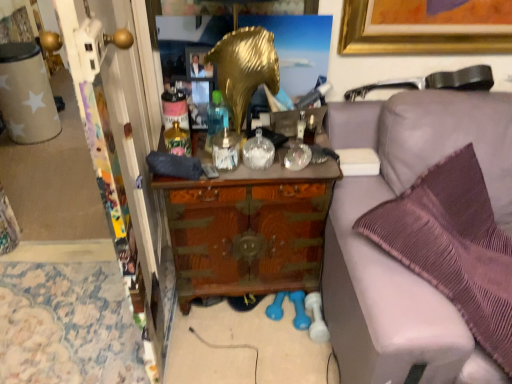
Question: Is wooden chest at center positioned behind gold metallic picture frame at upper center?

Choices:
 (A) yes
 (B) no

Answer: (B)

Question: Does wooden chest at center touch gold metallic picture frame at upper center?

Choices:
 (A) yes
 (B) no

Answer: (B)

Question: Considering the relative sizes of wooden chest at center and gold metallic picture frame at upper center in the image provided, is wooden chest at center shorter than gold metallic picture frame at upper center?

Choices:
 (A) yes
 (B) no

Answer: (B)

Question: Can you confirm if wooden chest at center is wider than gold metallic picture frame at upper center?

Choices:
 (A) yes
 (B) no

Answer: (A)

Question: Is wooden chest at center to the left of gold metallic picture frame at upper center from the viewer's perspective?

Choices:
 (A) no
 (B) yes

Answer: (A)

Question: From the image's perspective, is matte gray remote control at center above or below wooden chest at center?

Choices:
 (A) below
 (B) above

Answer: (B)

Question: Looking at their shapes, would you say matte gray remote control at center is wider or thinner than wooden chest at center?

Choices:
 (A) thin
 (B) wide

Answer: (A)

Question: From a real-world perspective, is matte gray remote control at center positioned above or below wooden chest at center?

Choices:
 (A) above
 (B) below

Answer: (A)

Question: Visually, is matte gray remote control at center positioned to the left or to the right of wooden chest at center?

Choices:
 (A) left
 (B) right

Answer: (A)

Question: Considering the positions of point (189, 56) and point (244, 269), is point (189, 56) closer or farther from the camera than point (244, 269)?

Choices:
 (A) farther
 (B) closer

Answer: (B)

Question: Is gold metallic picture frame at upper center wider or thinner than wooden chest at center?

Choices:
 (A) thin
 (B) wide

Answer: (A)

Question: From a real-world perspective, is gold metallic picture frame at upper center positioned above or below wooden chest at center?

Choices:
 (A) above
 (B) below

Answer: (A)

Question: Looking at the image, does gold metallic picture frame at upper center seem bigger or smaller compared to wooden chest at center?

Choices:
 (A) big
 (B) small

Answer: (B)

Question: From the image's perspective, is gold metallic picture frame at upper center positioned above or below purple fabric couch at right?

Choices:
 (A) below
 (B) above

Answer: (B)

Question: Is point coord(201,57) positioned closer to the camera than point coord(445,339)?

Choices:
 (A) farther
 (B) closer

Answer: (A)